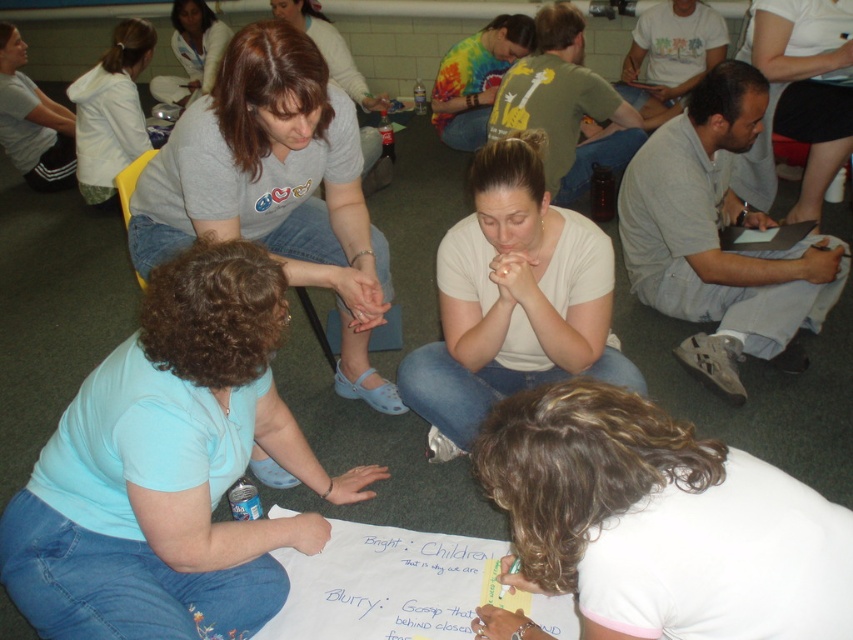
You are standing in front of the poster and notice two points marked on it. Which point is closer to you, point (575,337) or point (695,358)?

Point (575,337) is closer to the viewer than point (695,358).

Where is the matte gray shirt at center located in the image?

The matte gray shirt at center is located at point (x=276, y=188) in the image.

Based on the photo, you are a photographer standing in front of the group. You want to take a photo of the white matte shirt at lower center and the white cotton shirt at upper center. Which shirt will appear larger in the photo?

The white matte shirt at lower center will appear larger in the photo because it is closer to the viewer than the white cotton shirt at upper center.